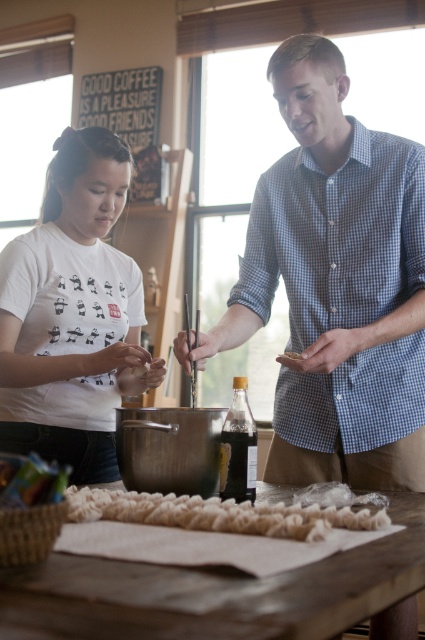
Question: Which object appears farthest from the camera in this image?

Choices:
 (A) wooden table at center
 (B) blue checkered shirt at center
 (C) white printed t-shirt at left

Answer: (C)

Question: Which of the following is the closest to the observer?

Choices:
 (A) (124, 156)
 (B) (380, 321)
 (C) (294, 353)

Answer: (C)

Question: Which point is farther to the camera?

Choices:
 (A) (294, 358)
 (B) (397, 196)

Answer: (B)

Question: Does blue checkered shirt at center come behind white printed t-shirt at left?

Choices:
 (A) yes
 (B) no

Answer: (B)

Question: In this image, where is white printed t-shirt at left located relative to wooden table at center?

Choices:
 (A) below
 (B) above

Answer: (B)

Question: Does wooden table at center appear under brown crumbly food at center?

Choices:
 (A) no
 (B) yes

Answer: (B)